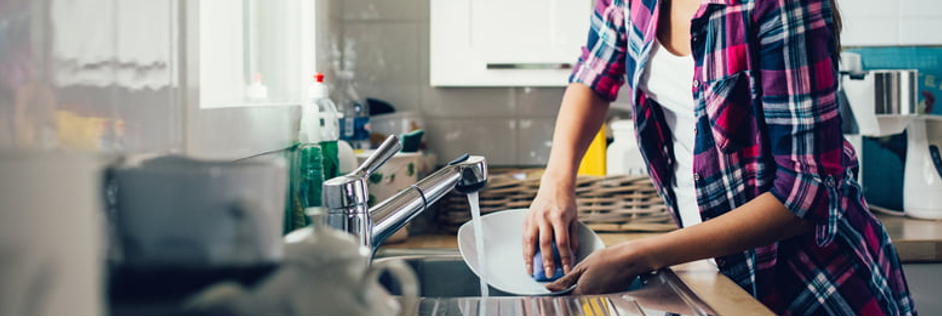
I want to click on cane basket, so click(x=614, y=201).